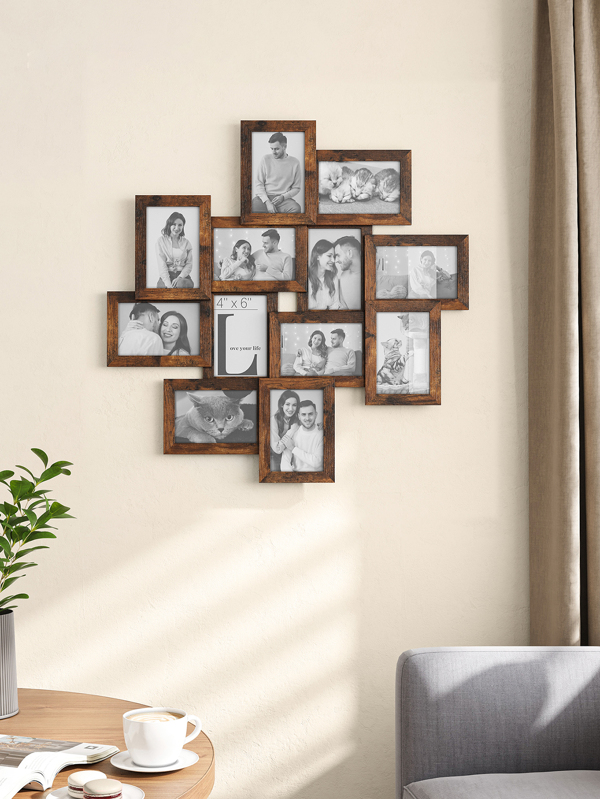
At what (x,y) coordinates should I click in order to perform the action: click on wall photos containing humans. Please return your answer as a coordinate pair (x, y). This screenshot has height=799, width=600. Looking at the image, I should click on (274, 173), (181, 253), (253, 249), (331, 265), (427, 269), (327, 344), (169, 322), (294, 420).